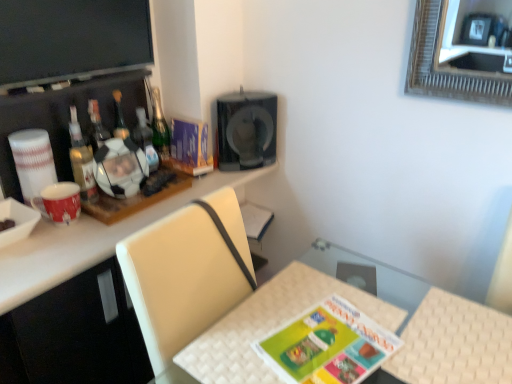
Find the location of a particular element. vacant region to the left of matte green board game at center is located at coordinates (238, 341).